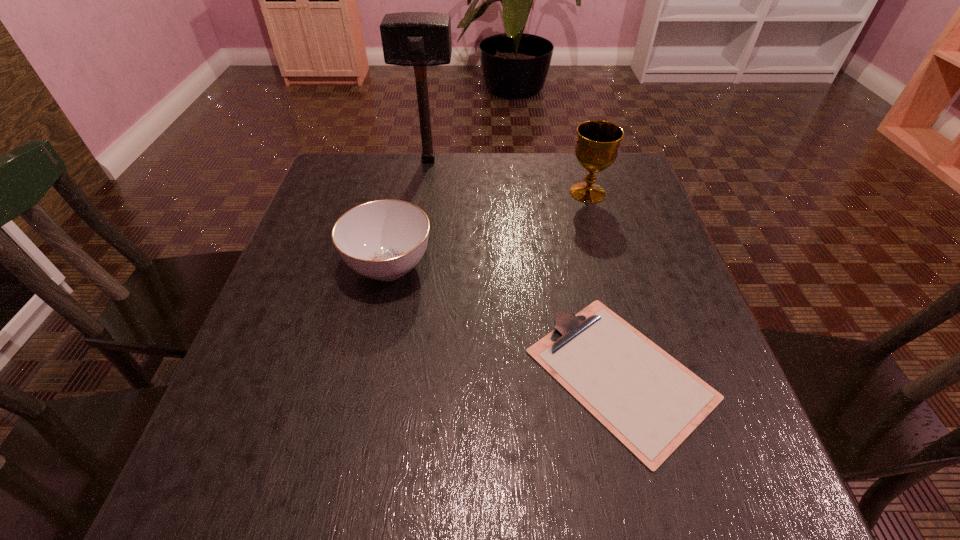
The width and height of the screenshot is (960, 540). Identify the location of blank region between the tallest object and the chalice. (508, 177).

Identify the location of vacant space in between the third farthest object and the clipboard. (505, 320).

In order to click on object that is the closest one to the third farthest object in this screenshot , I will do `click(650, 402)`.

Identify which object is the closest to the third farthest object. Please provide its 2D coordinates. Your answer should be formatted as a tuple, i.e. [(x, y)], where the tuple contains the x and y coordinates of a point satisfying the conditions above.

[(650, 402)]

Find the location of a particular element. This screenshot has height=540, width=960. free space that satisfies the following two spatial constraints: 1. on the back side of the clipboard; 2. on the right side of the third shortest object is located at coordinates (575, 193).

Locate an element on the screen. This screenshot has height=540, width=960. free point that satisfies the following two spatial constraints: 1. on the front side of the third shortest object; 2. on the left side of the mallet is located at coordinates (423, 193).

Find the location of a particular element. The image size is (960, 540). vacant space that satisfies the following two spatial constraints: 1. on the back side of the third farthest object; 2. on the right side of the farthest object is located at coordinates (411, 160).

Identify the location of free space that satisfies the following two spatial constraints: 1. on the front side of the third farthest object; 2. on the right side of the nearest object. (367, 374).